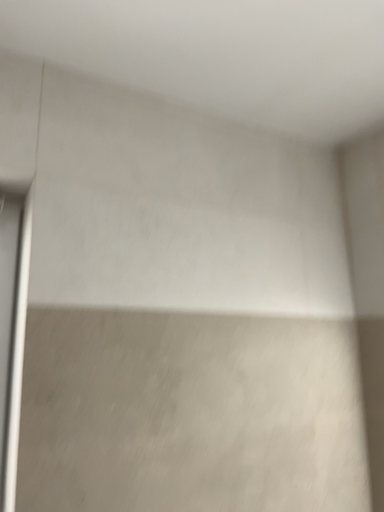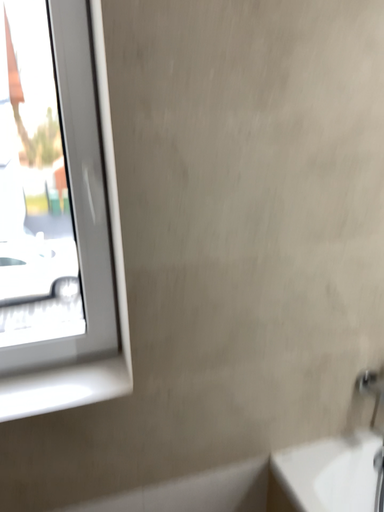
Question: Which way did the camera rotate in the video?

Choices:
 (A) rotated right
 (B) rotated left

Answer: (B)